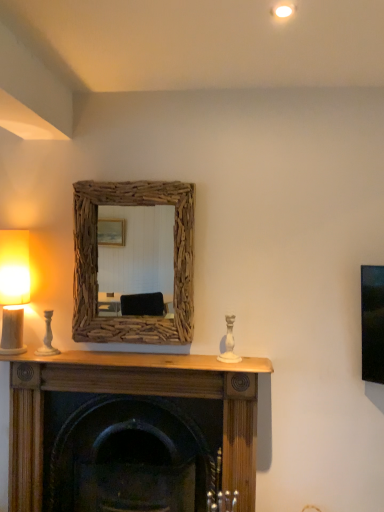
Question: Considering the relative sizes of wooden fireplace at center and driftwood mirror at center in the image provided, is wooden fireplace at center thinner than driftwood mirror at center?

Choices:
 (A) no
 (B) yes

Answer: (A)

Question: Is wooden fireplace at center touching driftwood mirror at center?

Choices:
 (A) yes
 (B) no

Answer: (B)

Question: Considering the relative sizes of wooden fireplace at center and driftwood mirror at center in the image provided, is wooden fireplace at center shorter than driftwood mirror at center?

Choices:
 (A) yes
 (B) no

Answer: (B)

Question: Is wooden fireplace at center positioned behind driftwood mirror at center?

Choices:
 (A) no
 (B) yes

Answer: (A)

Question: Would you say wooden fireplace at center is a long distance from driftwood mirror at center?

Choices:
 (A) no
 (B) yes

Answer: (A)

Question: Considering the relative positions of driftwood mirror at center and wooden fireplace at center in the image provided, is driftwood mirror at center to the left or to the right of wooden fireplace at center?

Choices:
 (A) left
 (B) right

Answer: (A)

Question: Does point (99, 199) appear closer or farther from the camera than point (226, 476)?

Choices:
 (A) closer
 (B) farther

Answer: (B)

Question: From a real-world perspective, relative to wooden fireplace at center, is driftwood mirror at center vertically above or below?

Choices:
 (A) above
 (B) below

Answer: (A)

Question: Is driftwood mirror at center in front of or behind wooden fireplace at center in the image?

Choices:
 (A) behind
 (B) front

Answer: (A)

Question: Relative to matte white table lamp at left, is wooden fireplace at center in front or behind?

Choices:
 (A) behind
 (B) front

Answer: (B)

Question: Is wooden fireplace at center taller or shorter than matte white table lamp at left?

Choices:
 (A) short
 (B) tall

Answer: (B)

Question: Is wooden fireplace at center to the left or to the right of matte white table lamp at left in the image?

Choices:
 (A) right
 (B) left

Answer: (A)

Question: Is wooden fireplace at center inside the boundaries of matte white table lamp at left, or outside?

Choices:
 (A) outside
 (B) inside

Answer: (A)

Question: Does point (29, 280) appear closer or farther from the camera than point (178, 214)?

Choices:
 (A) farther
 (B) closer

Answer: (B)

Question: From their relative heights in the image, would you say matte white table lamp at left is taller or shorter than driftwood mirror at center?

Choices:
 (A) tall
 (B) short

Answer: (B)